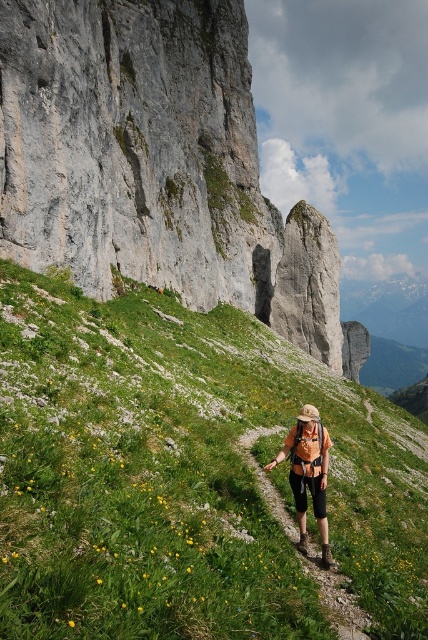
You are a hiker planning to set up a tent. You have a gray rock formation at upper center and an orange fabric backpack at center in your view. Which object is taller and could potentially provide better wind protection?

The gray rock formation at upper center is much taller than the orange fabric backpack at center, so it could provide better wind protection.